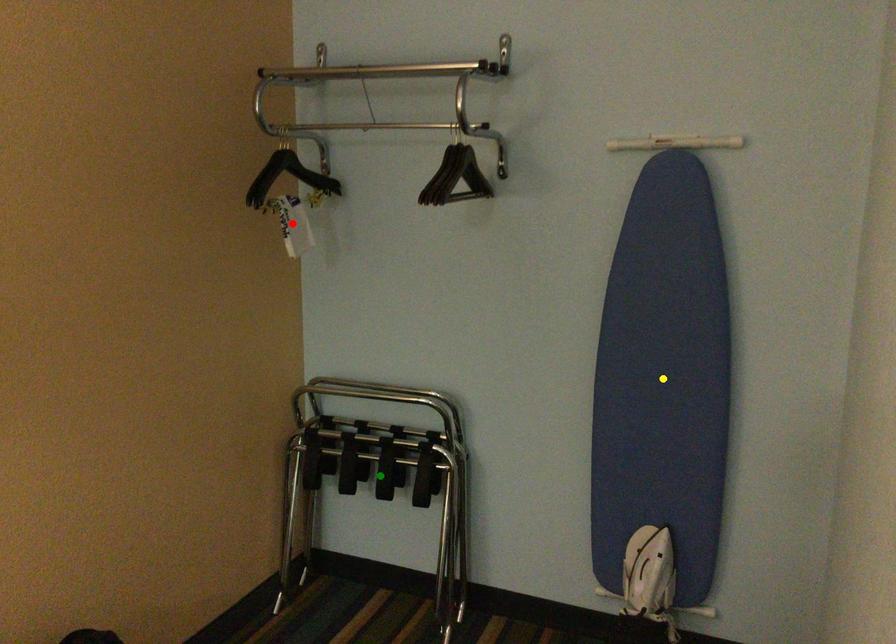
Order these from nearest to farthest:
red point | yellow point | green point

yellow point, red point, green point